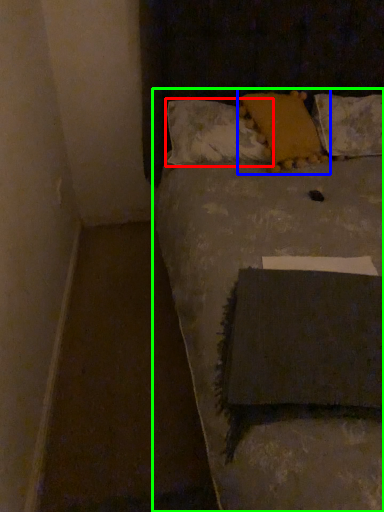
Question: Considering the real-world distances, which object is closest to pillow (highlighted by a red box)? pillow (highlighted by a blue box) or furniture (highlighted by a green box).

Choices:
 (A) pillow
 (B) furniture

Answer: (A)